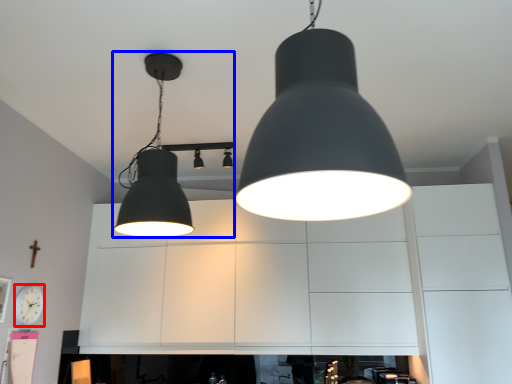
Question: Which of the following is the farthest to the observer, clock (highlighted by a red box) or lamp (highlighted by a blue box)?

Choices:
 (A) clock
 (B) lamp

Answer: (A)